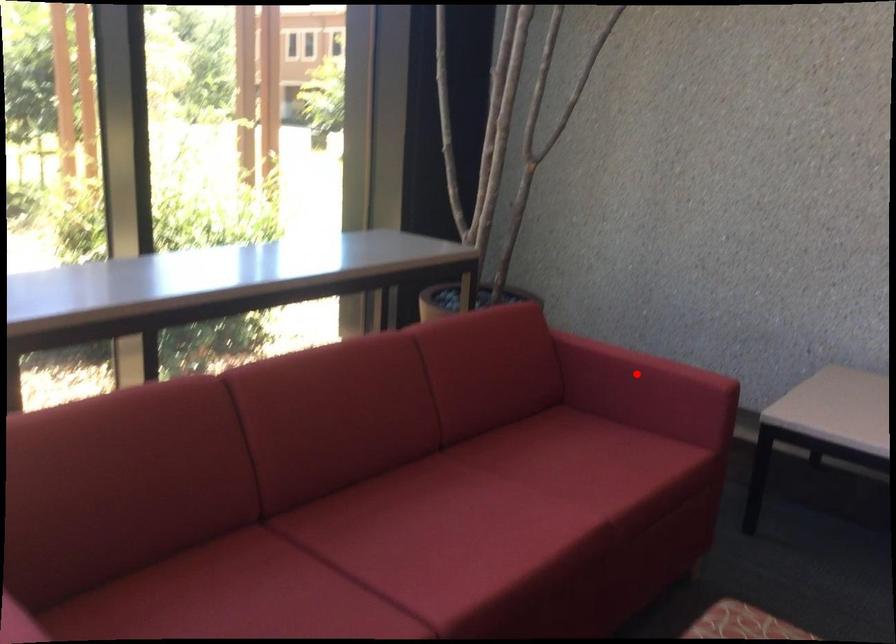
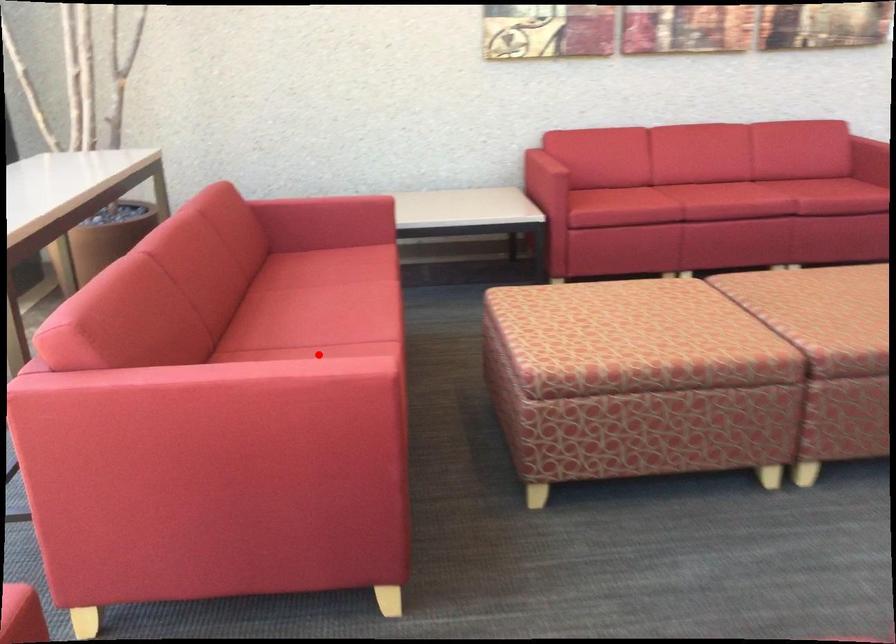
In the scene shown: I am providing you with two images of the same scene from different viewpoints. A red point is marked on the first image and another point is marked on the second image. Are the points marked in image1 and image2 representing the same 3D position?

No